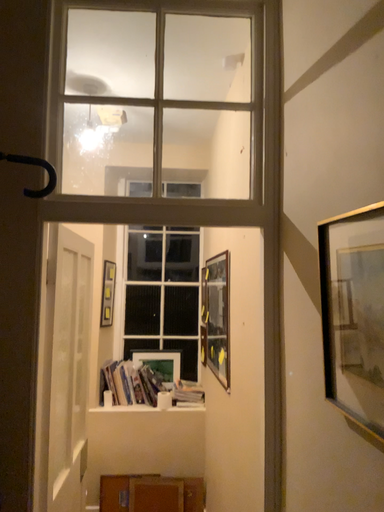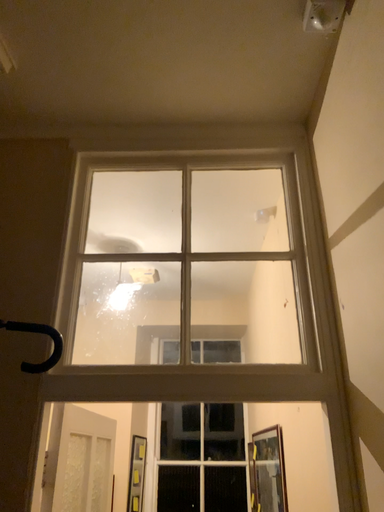
Question: Which way did the camera rotate in the video?

Choices:
 (A) rotated upward
 (B) rotated downward

Answer: (A)